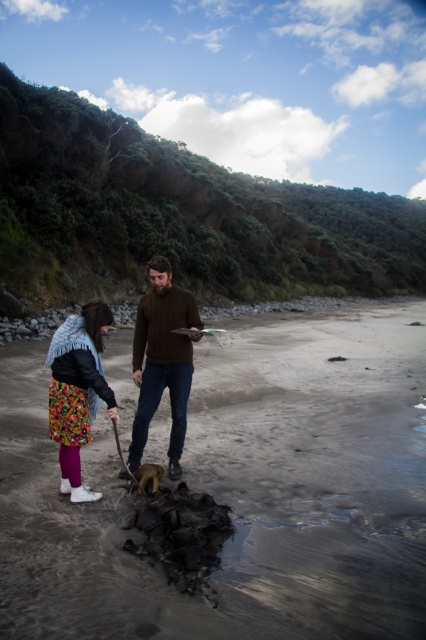
You are a photographer trying to capture the scene of the two people on the beach. You want to focus on the dark sand at center and the brown knitted sweater at center. Which object should you adjust your camera focus on first to ensure both are in the frame?

The dark sand at center is closer to the viewer than the brown knitted sweater at center, so you should focus on the dark sand at center first to ensure both are in the frame.